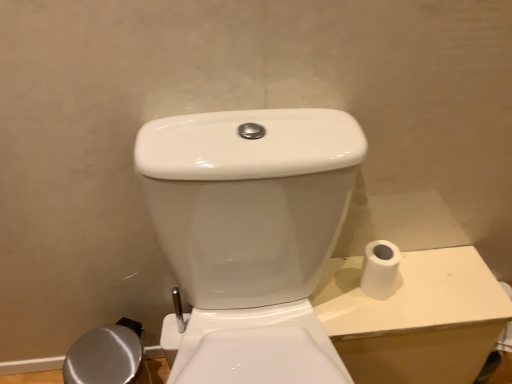
Question: Considering the relative sizes of white glossy porcelain at right and white matte toilet paper at right in the image provided, is white glossy porcelain at right shorter than white matte toilet paper at right?

Choices:
 (A) no
 (B) yes

Answer: (A)

Question: Is white glossy porcelain at right surrounding white matte toilet paper at right?

Choices:
 (A) no
 (B) yes

Answer: (A)

Question: From a real-world perspective, is white glossy porcelain at right positioned over white matte toilet paper at right based on gravity?

Choices:
 (A) no
 (B) yes

Answer: (A)

Question: Considering the relative sizes of white glossy porcelain at right and white matte toilet paper at right in the image provided, is white glossy porcelain at right taller than white matte toilet paper at right?

Choices:
 (A) yes
 (B) no

Answer: (A)

Question: Is white matte toilet paper at right at the back of white glossy porcelain at right?

Choices:
 (A) yes
 (B) no

Answer: (B)

Question: Does white glossy porcelain at right turn towards white matte toilet paper at right?

Choices:
 (A) yes
 (B) no

Answer: (B)

Question: From a real-world perspective, does white matte toilet paper at right sit lower than white glossy porcelain at right?

Choices:
 (A) no
 (B) yes

Answer: (A)

Question: Can you confirm if white matte toilet paper at right is taller than white glossy porcelain at right?

Choices:
 (A) yes
 (B) no

Answer: (B)

Question: Is white matte toilet paper at right placed right next to white glossy porcelain at right?

Choices:
 (A) no
 (B) yes

Answer: (A)

Question: Can you confirm if white matte toilet paper at right is thinner than white glossy porcelain at right?

Choices:
 (A) no
 (B) yes

Answer: (B)

Question: From a real-world perspective, does white matte toilet paper at right stand above white glossy porcelain at right?

Choices:
 (A) no
 (B) yes

Answer: (B)

Question: Does white matte toilet paper at right contain white glossy porcelain at right?

Choices:
 (A) yes
 (B) no

Answer: (B)

Question: Looking at their shapes, would you say white matte toilet paper at right is wider or thinner than white glossy porcelain at right?

Choices:
 (A) thin
 (B) wide

Answer: (A)